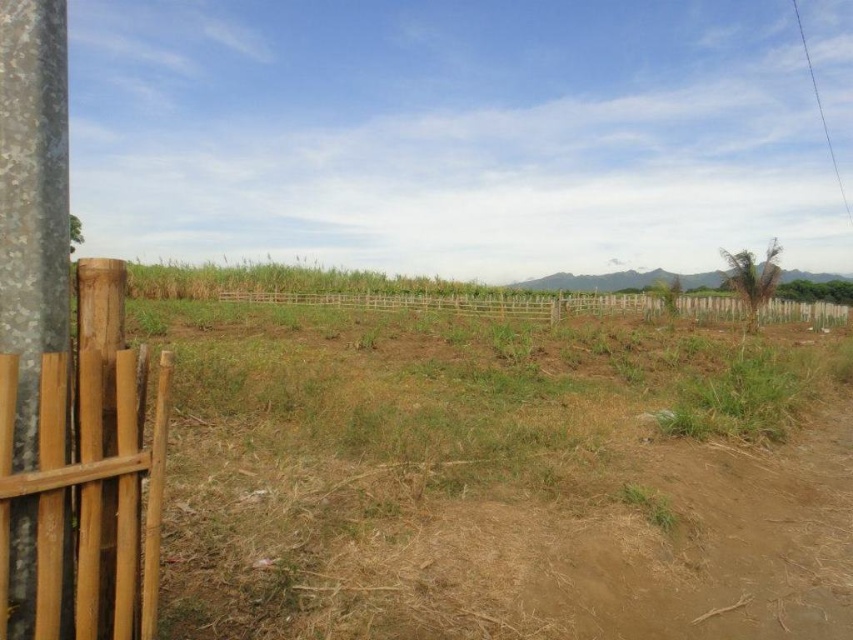
Question: From the image, what is the correct spatial relationship of galvanized metal pole at left in relation to brown wooden fence at left?

Choices:
 (A) left
 (B) right

Answer: (A)

Question: Which point is farther to the camera?

Choices:
 (A) brown dry soil at center
 (B) brown wooden fence at left

Answer: (A)

Question: Does brown wooden fence at left appear over brown wooden fence at center?

Choices:
 (A) no
 (B) yes

Answer: (A)

Question: Which of these objects is positioned farthest from the brown wooden fence at center?

Choices:
 (A) galvanized metal pole at left
 (B) brown dry soil at center

Answer: (A)

Question: Does galvanized metal pole at left have a lesser width compared to brown wooden fence at center?

Choices:
 (A) yes
 (B) no

Answer: (A)

Question: Which object appears farthest from the camera in this image?

Choices:
 (A) brown wooden fence at left
 (B) brown dry soil at center

Answer: (B)